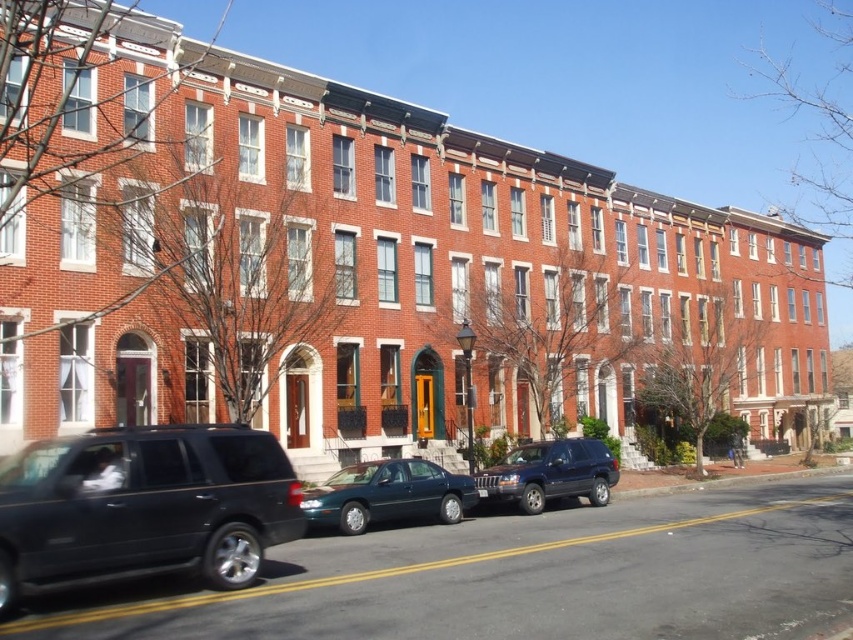
Question: Can you confirm if shiny black suv at lower left is positioned below shiny dark blue suv at center?

Choices:
 (A) no
 (B) yes

Answer: (A)

Question: Where is shiny black suv at lower left located in relation to teal glossy sedan at center in the image?

Choices:
 (A) above
 (B) below

Answer: (A)

Question: Which of the following is the closest to the observer?

Choices:
 (A) teal glossy sedan at center
 (B) shiny dark blue suv at center
 (C) shiny black suv at lower left

Answer: (C)

Question: Among these objects, which one is nearest to the camera?

Choices:
 (A) shiny dark blue suv at center
 (B) shiny black suv at lower left

Answer: (B)

Question: Does shiny black suv at lower left appear under teal glossy sedan at center?

Choices:
 (A) no
 (B) yes

Answer: (A)

Question: Among these points, which one is farthest from the camera?

Choices:
 (A) (602, 448)
 (B) (264, 518)
 (C) (380, 492)

Answer: (A)